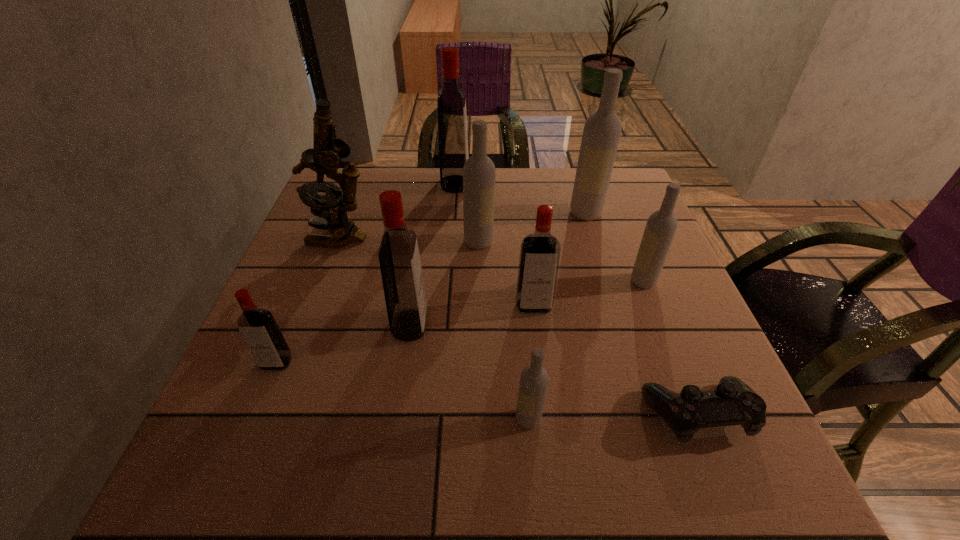
At what (x,y) coordinates should I click in order to perform the action: click on free spot between the farthest white vodka and the nearest white vodka. Please return your answer as a coordinate pair (x, y). The width and height of the screenshot is (960, 540). Looking at the image, I should click on [x=557, y=316].

The image size is (960, 540). In order to click on vacant space that is in between the shortest object and the microscope in this screenshot , I will do `click(518, 326)`.

You are a GUI agent. You are given a task and a screenshot of the screen. Output one action in this format:
    pyautogui.click(x=<x>, y=<y>)
    Task: Click on the vacant space that is in between the farthest object and the second smallest red vodka
    The width and height of the screenshot is (960, 540).
    Given the screenshot: What is the action you would take?
    pyautogui.click(x=494, y=245)

Where is `unoccupied position between the second nearest vodka and the second biggest red vodka`? Image resolution: width=960 pixels, height=540 pixels. unoccupied position between the second nearest vodka and the second biggest red vodka is located at coordinates (344, 344).

The height and width of the screenshot is (540, 960). Find the location of `vacant area that lies between the nearest vodka and the farthest object`. vacant area that lies between the nearest vodka and the farthest object is located at coordinates (492, 301).

Where is `free space between the leftmost vodka and the second vodka from right to left`? free space between the leftmost vodka and the second vodka from right to left is located at coordinates (431, 288).

The width and height of the screenshot is (960, 540). Identify the location of vacant area that lies between the third white vodka from right to left and the third farthest vodka. (504, 330).

At what (x,y) coordinates should I click in order to perform the action: click on the eighth closest object relative to the rightmost red vodka. Please return your answer as a coordinate pair (x, y). This screenshot has height=540, width=960. Looking at the image, I should click on (452, 119).

Locate which object is the third closest to the third nearest object. Please provide its 2D coordinates. Your answer should be formatted as a tuple, i.e. [(x, y)], where the tuple contains the x and y coordinates of a point satisfying the conditions above.

[(533, 384)]

Identify the location of the seventh closest vodka to the control. click(x=258, y=327).